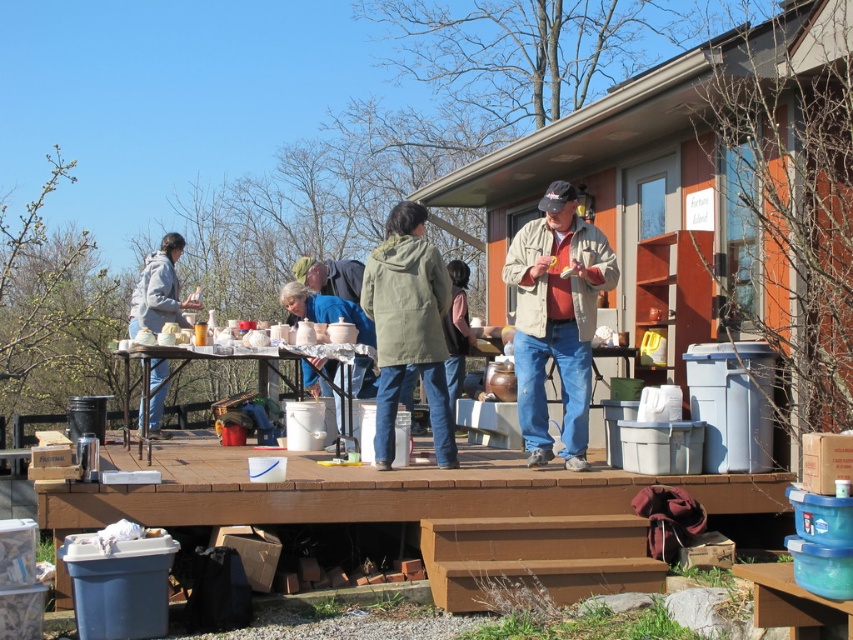
Question: Can you confirm if green matte jacket at center is positioned below denim jacket at center?

Choices:
 (A) no
 (B) yes

Answer: (B)

Question: Can you confirm if brown wood deck at lower center is positioned to the left of denim jacket at center?

Choices:
 (A) yes
 (B) no

Answer: (A)

Question: Which point appears farthest from the camera in this image?

Choices:
 (A) (144, 323)
 (B) (428, 272)
 (C) (577, 234)

Answer: (A)

Question: Which object appears farthest from the camera in this image?

Choices:
 (A) denim jacket at center
 (B) green matte jacket at center
 (C) brown wood deck at lower center

Answer: (A)

Question: Can you confirm if matte gray jacket at center is wider than matte white bucket at center?

Choices:
 (A) yes
 (B) no

Answer: (B)

Question: Based on their relative distances, which object is nearer to the tan fabric jacket at center?

Choices:
 (A) denim jacket at center
 (B) matte white bucket at center
 (C) brown wood deck at lower center
 (D) green matte jacket at center

Answer: (D)